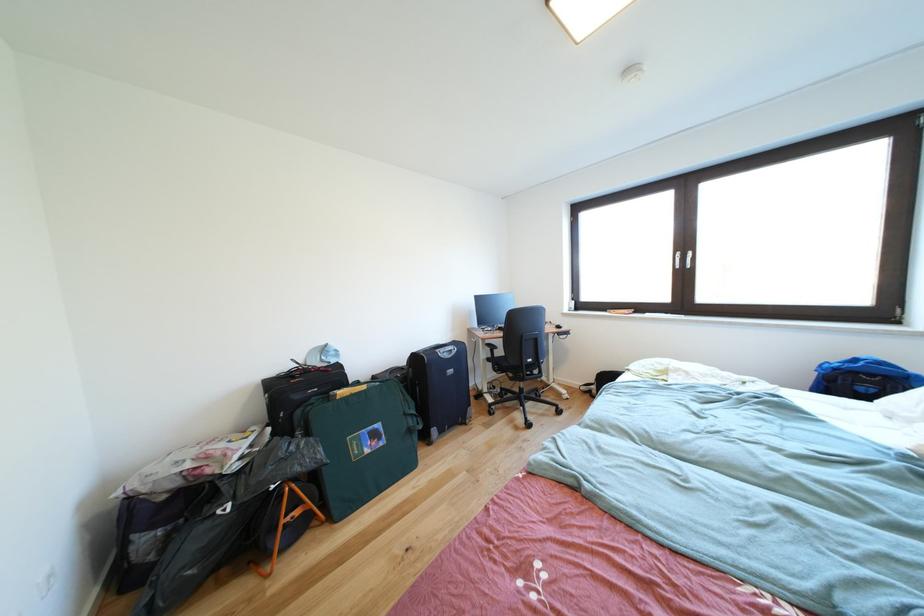
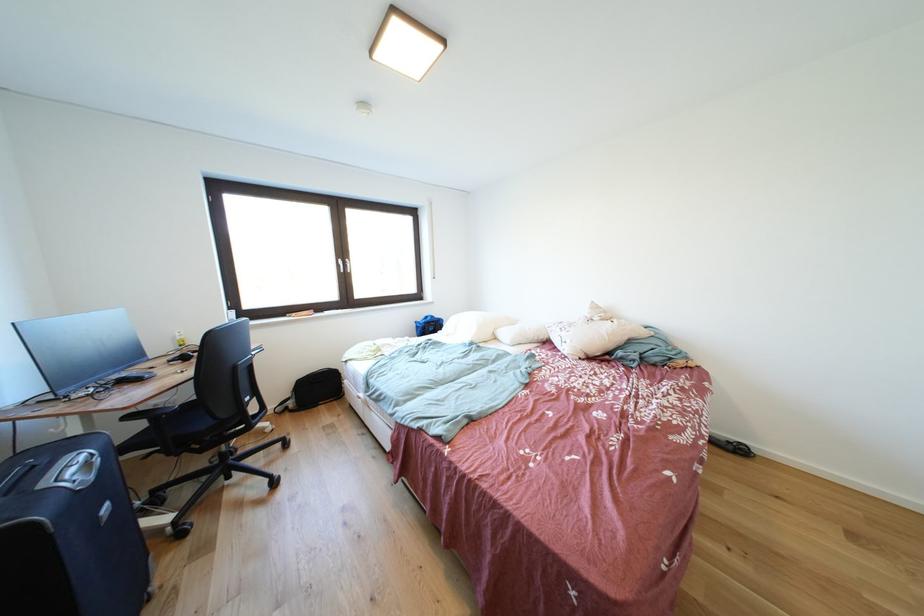
In the second image, find the point that corresponds to point 687,259 in the first image.

(348, 265)